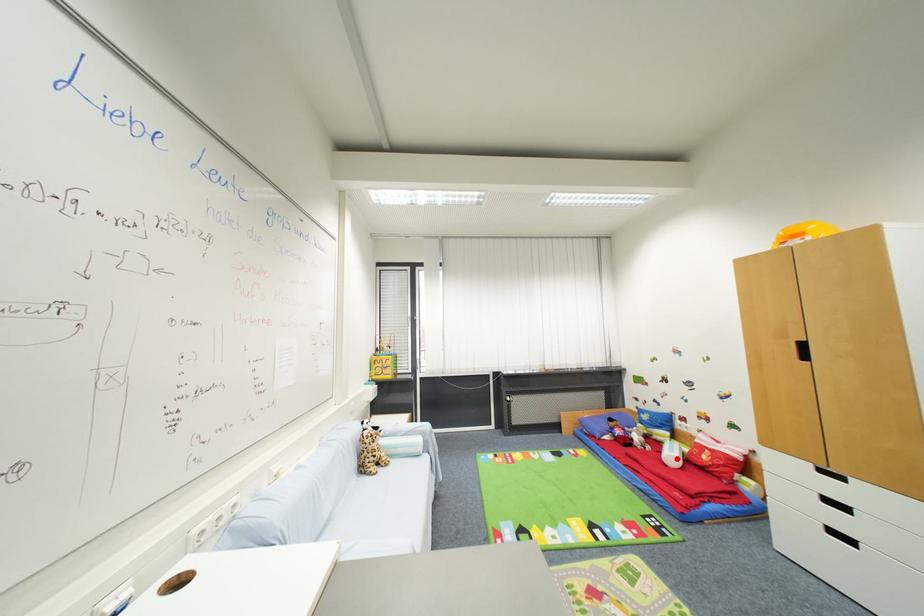
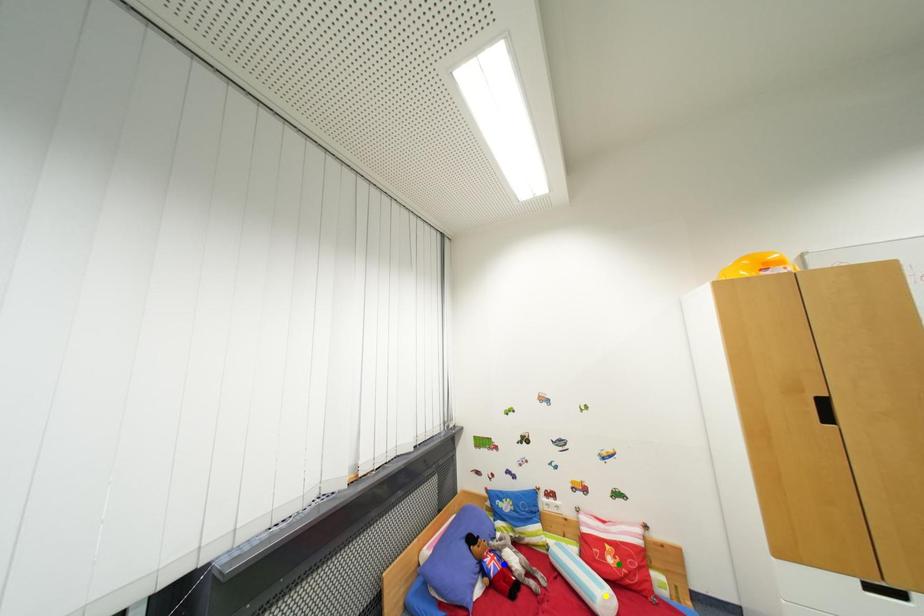
Question: I am providing you with two images of the same scene from different viewpoints. A red point is marked on the first image. You are given multiple points on the second image. Which spot in image 2 lines up with the point in image 1?

Choices:
 (A) green point
 (B) blue point
 (C) yellow point

Answer: (C)